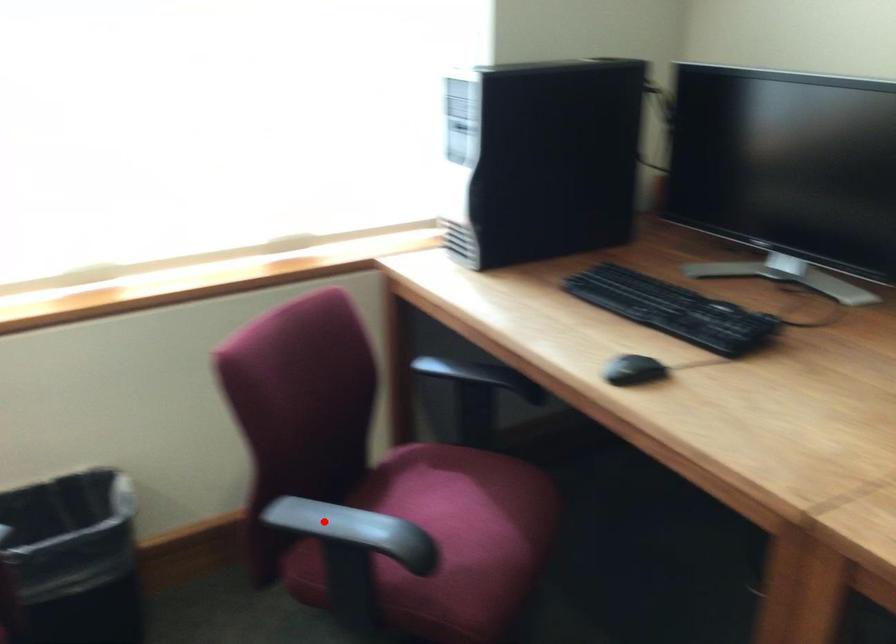
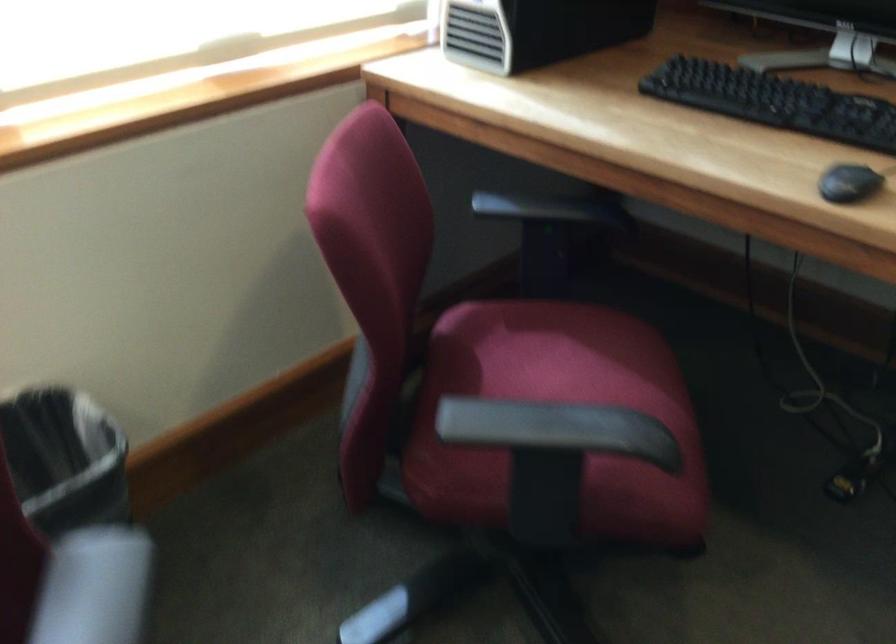
Question: I am providing you with two images of the same scene from different viewpoints. Image1 has a red point marked. In image2, the corresponding 3D location appears at what relative position? Reply with the corresponding letter.

Choices:
 (A) Closer
 (B) Farther

Answer: (A)